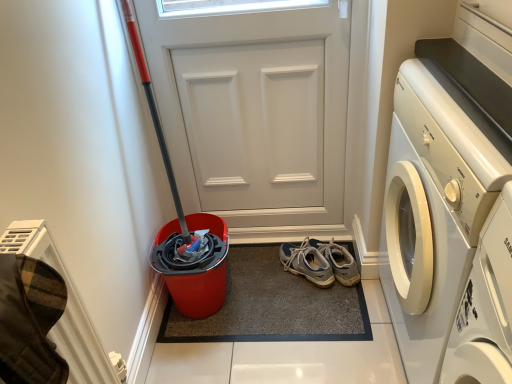
Question: Is white glossy washing machine at right surrounded by carpeted mat at center?

Choices:
 (A) no
 (B) yes

Answer: (A)

Question: Is carpeted mat at center in contact with white glossy washing machine at right?

Choices:
 (A) no
 (B) yes

Answer: (A)

Question: From a real-world perspective, is carpeted mat at center positioned over white glossy washing machine at right based on gravity?

Choices:
 (A) no
 (B) yes

Answer: (A)

Question: Considering the relative sizes of carpeted mat at center and white glossy washing machine at right in the image provided, is carpeted mat at center bigger than white glossy washing machine at right?

Choices:
 (A) no
 (B) yes

Answer: (A)

Question: Is carpeted mat at center completely or partially outside of white glossy washing machine at right?

Choices:
 (A) no
 (B) yes

Answer: (B)

Question: Relative to light blue suede sneakers at center, is white matte door at center in front or behind?

Choices:
 (A) front
 (B) behind

Answer: (A)

Question: Is white matte door at center situated inside light blue suede sneakers at center or outside?

Choices:
 (A) inside
 (B) outside

Answer: (B)

Question: Based on their positions, is white matte door at center located to the left or right of light blue suede sneakers at center?

Choices:
 (A) left
 (B) right

Answer: (A)

Question: From their relative heights in the image, would you say white matte door at center is taller or shorter than light blue suede sneakers at center?

Choices:
 (A) tall
 (B) short

Answer: (A)

Question: Do you think light blue suede sneakers at center is within white matte door at center, or outside of it?

Choices:
 (A) inside
 (B) outside

Answer: (B)

Question: From the image's perspective, is light blue suede sneakers at center positioned above or below white matte door at center?

Choices:
 (A) above
 (B) below

Answer: (B)

Question: Is light blue suede sneakers at center bigger or smaller than white matte door at center?

Choices:
 (A) small
 (B) big

Answer: (A)

Question: In terms of width, does light blue suede sneakers at center look wider or thinner when compared to white matte door at center?

Choices:
 (A) thin
 (B) wide

Answer: (B)

Question: From the image's perspective, is white matte door at center above or below white glossy washing machine at right?

Choices:
 (A) below
 (B) above

Answer: (B)

Question: Relative to white glossy washing machine at right, is white matte door at center in front or behind?

Choices:
 (A) behind
 (B) front

Answer: (A)